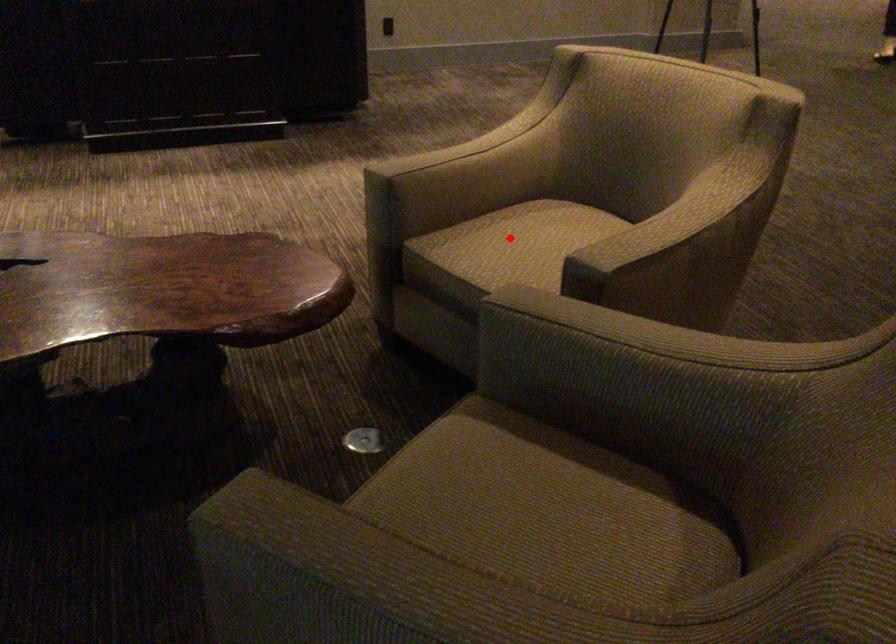
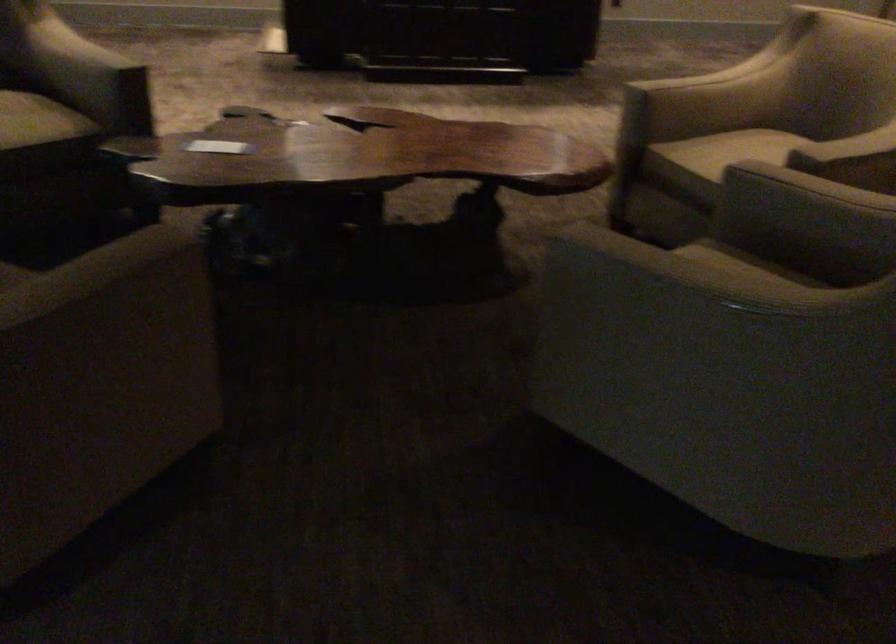
The point at the highlighted location is marked in the first image. Where is the corresponding point in the second image?

(741, 149)